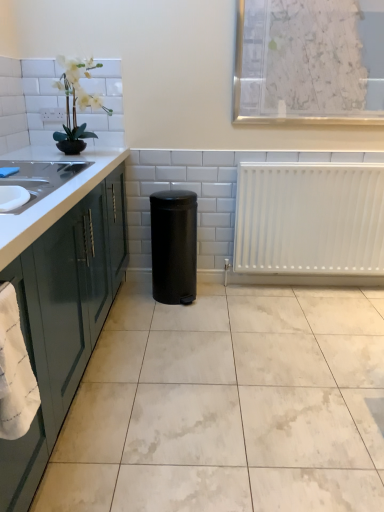
Question: Is white marble floor at center outside white textured paper at upper center?

Choices:
 (A) no
 (B) yes

Answer: (B)

Question: Can you confirm if white marble floor at center is shorter than white textured paper at upper center?

Choices:
 (A) yes
 (B) no

Answer: (A)

Question: From a real-world perspective, is white marble floor at center physically above white textured paper at upper center?

Choices:
 (A) no
 (B) yes

Answer: (A)

Question: Can you confirm if white marble floor at center is positioned to the right of white textured paper at upper center?

Choices:
 (A) yes
 (B) no

Answer: (B)

Question: Could you tell me if white marble floor at center is facing white textured paper at upper center?

Choices:
 (A) yes
 (B) no

Answer: (B)

Question: Relative to white matte radiator at right, is green glossy cabinetry at left in front or behind?

Choices:
 (A) front
 (B) behind

Answer: (A)

Question: From the image's perspective, is green glossy cabinetry at left above or below white matte radiator at right?

Choices:
 (A) below
 (B) above

Answer: (A)

Question: Do you think green glossy cabinetry at left is within white matte radiator at right, or outside of it?

Choices:
 (A) outside
 (B) inside

Answer: (A)

Question: From their relative heights in the image, would you say green glossy cabinetry at left is taller or shorter than white matte radiator at right?

Choices:
 (A) short
 (B) tall

Answer: (B)

Question: Relative to black matte trash can at center, is white marble floor at center in front or behind?

Choices:
 (A) behind
 (B) front

Answer: (B)

Question: From the image's perspective, relative to black matte trash can at center, is white marble floor at center above or below?

Choices:
 (A) above
 (B) below

Answer: (B)

Question: Is white marble floor at center inside or outside of black matte trash can at center?

Choices:
 (A) outside
 (B) inside

Answer: (A)

Question: Visually, is white marble floor at center positioned to the left or to the right of black matte trash can at center?

Choices:
 (A) left
 (B) right

Answer: (B)

Question: In terms of width, does green glossy cabinetry at left look wider or thinner when compared to white artificial plant at upper left?

Choices:
 (A) wide
 (B) thin

Answer: (A)

Question: From a real-world perspective, is green glossy cabinetry at left above or below white artificial plant at upper left?

Choices:
 (A) above
 (B) below

Answer: (B)